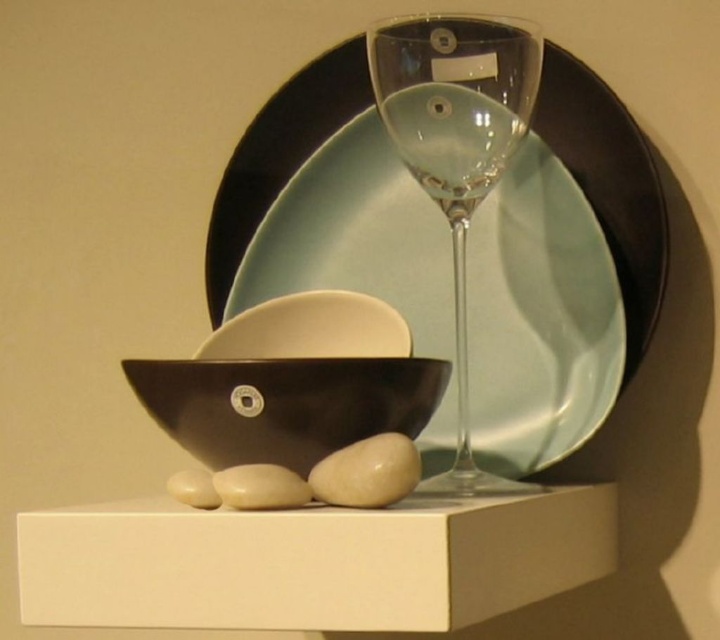
What is the color and material of the object located at the coordinates point (310, 330)?

The object at point (310, 330) is a matte black bowl.

You are arranging a table setting for a dinner party and need to place the transparent glass wine glass at center and the smooth beige stone at lower center. Which object is taller?

The transparent glass wine glass at center is taller than the smooth beige stone at lower center.